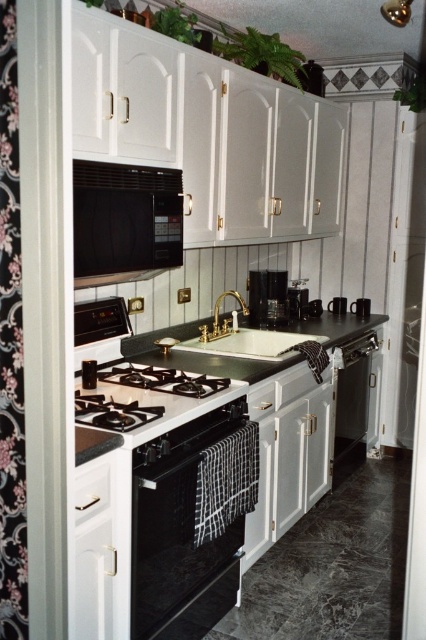
From the picture: Does black matte microwave at upper center appear on the right side of white matte drawer at lower left?

Incorrect, black matte microwave at upper center is not on the right side of white matte drawer at lower left.

Which is in front, point (178, 193) or point (75, 477)?

Point (75, 477) is in front.

This screenshot has width=426, height=640. What do you see at coordinates (124, 221) in the screenshot?
I see `black matte microwave at upper center` at bounding box center [124, 221].

Identify the location of black matte microwave at upper center. Image resolution: width=426 pixels, height=640 pixels. click(x=124, y=221).

Can you confirm if black matte oven at center is positioned below white porcelain sink at center?

Yes, black matte oven at center is below white porcelain sink at center.

Who is taller, black matte oven at center or white porcelain sink at center?

With more height is black matte oven at center.

Between point (252, 477) and point (287, 332), which one is positioned in front?

Point (252, 477)

This screenshot has width=426, height=640. I want to click on black matte oven at center, so click(x=190, y=522).

Can you confirm if black matte microwave at upper center is positioned below green granite countertop at center?

No, black matte microwave at upper center is not below green granite countertop at center.

Is black matte microwave at upper center to the left of green granite countertop at center from the viewer's perspective?

Correct, you'll find black matte microwave at upper center to the left of green granite countertop at center.

Is point (158, 212) more distant than point (203, 371)?

No, it is not.

I want to click on black matte microwave at upper center, so click(x=124, y=221).